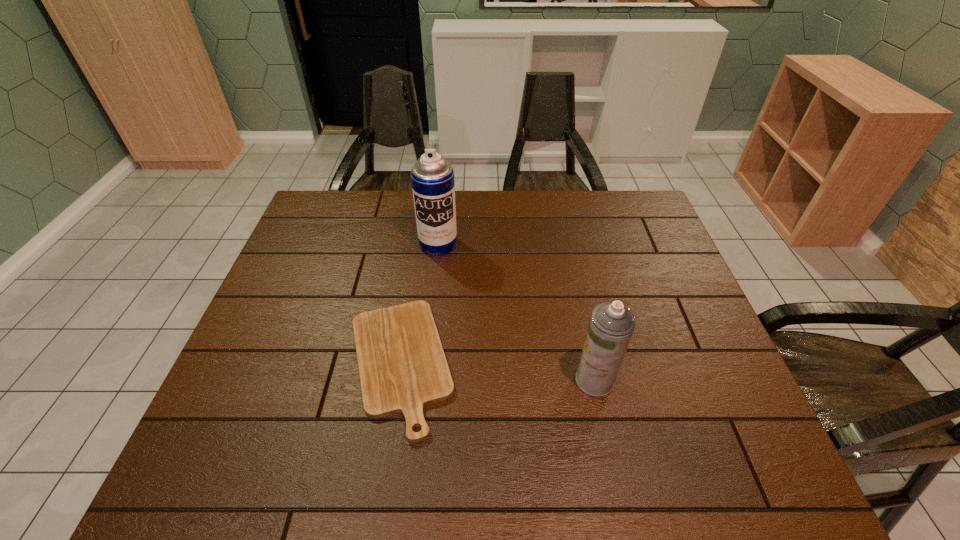
Where is `the left aerosol can`? the left aerosol can is located at coordinates (432, 177).

Where is `the tallest object`? the tallest object is located at coordinates (432, 177).

Where is `the right aerosol can`? This screenshot has width=960, height=540. the right aerosol can is located at coordinates (611, 326).

You are a GUI agent. You are given a task and a screenshot of the screen. Output one action in this format:
    pyautogui.click(x=<x>, y=<y>)
    Task: Click on the rightmost object
    
    Given the screenshot: What is the action you would take?
    pyautogui.click(x=611, y=326)

What are the coordinates of `the shortest object` in the screenshot? It's located at click(x=402, y=366).

The width and height of the screenshot is (960, 540). I want to click on free region located on the label side of the left aerosol can, so click(x=425, y=359).

Where is `vacant space located 0.210m on the back of the right aerosol can`? The width and height of the screenshot is (960, 540). vacant space located 0.210m on the back of the right aerosol can is located at coordinates (577, 299).

The image size is (960, 540). In order to click on vacant area situated on the back of the chopping board in this screenshot , I will do `click(419, 244)`.

This screenshot has width=960, height=540. In order to click on object that is positioned at the far edge in this screenshot , I will do `click(432, 177)`.

This screenshot has width=960, height=540. Find the location of `object at the near edge`. object at the near edge is located at coordinates (402, 366).